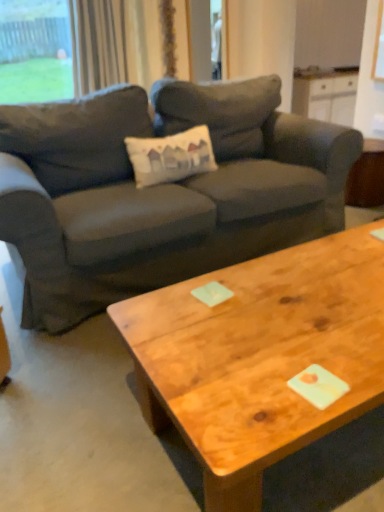
Question: Is the depth of green glass window at upper left greater than that of wooden side table at right?

Choices:
 (A) no
 (B) yes

Answer: (B)

Question: Is green glass window at upper left aimed at wooden side table at right?

Choices:
 (A) no
 (B) yes

Answer: (A)

Question: Considering the relative sizes of green glass window at upper left and wooden side table at right in the image provided, is green glass window at upper left shorter than wooden side table at right?

Choices:
 (A) yes
 (B) no

Answer: (B)

Question: Considering the relative sizes of green glass window at upper left and wooden side table at right in the image provided, is green glass window at upper left smaller than wooden side table at right?

Choices:
 (A) yes
 (B) no

Answer: (A)

Question: Can you confirm if green glass window at upper left is wider than wooden side table at right?

Choices:
 (A) yes
 (B) no

Answer: (B)

Question: Looking at their shapes, would you say wooden coffee table at center is wider or thinner than light beige fabric curtain at upper left?

Choices:
 (A) wide
 (B) thin

Answer: (A)

Question: Is wooden coffee table at center taller or shorter than light beige fabric curtain at upper left?

Choices:
 (A) tall
 (B) short

Answer: (B)

Question: Would you say wooden coffee table at center is to the left or to the right of light beige fabric curtain at upper left in the picture?

Choices:
 (A) left
 (B) right

Answer: (B)

Question: From the image's perspective, is wooden coffee table at center located above or below light beige fabric curtain at upper left?

Choices:
 (A) above
 (B) below

Answer: (B)

Question: Based on their positions, is light beige fabric curtain at upper left located to the left or right of dark gray fabric couch at center?

Choices:
 (A) right
 (B) left

Answer: (B)

Question: From a real-world perspective, is light beige fabric curtain at upper left positioned above or below dark gray fabric couch at center?

Choices:
 (A) above
 (B) below

Answer: (A)

Question: In the image, is light beige fabric curtain at upper left positioned in front of or behind dark gray fabric couch at center?

Choices:
 (A) behind
 (B) front

Answer: (A)

Question: Does point pyautogui.click(x=168, y=27) appear closer or farther from the camera than point pyautogui.click(x=241, y=214)?

Choices:
 (A) closer
 (B) farther

Answer: (B)

Question: From the image's perspective, is dark gray fabric couch at center above or below light beige fabric curtain at upper left?

Choices:
 (A) above
 (B) below

Answer: (B)

Question: Considering the positions of dark gray fabric couch at center and light beige fabric curtain at upper left in the image, is dark gray fabric couch at center wider or thinner than light beige fabric curtain at upper left?

Choices:
 (A) wide
 (B) thin

Answer: (A)